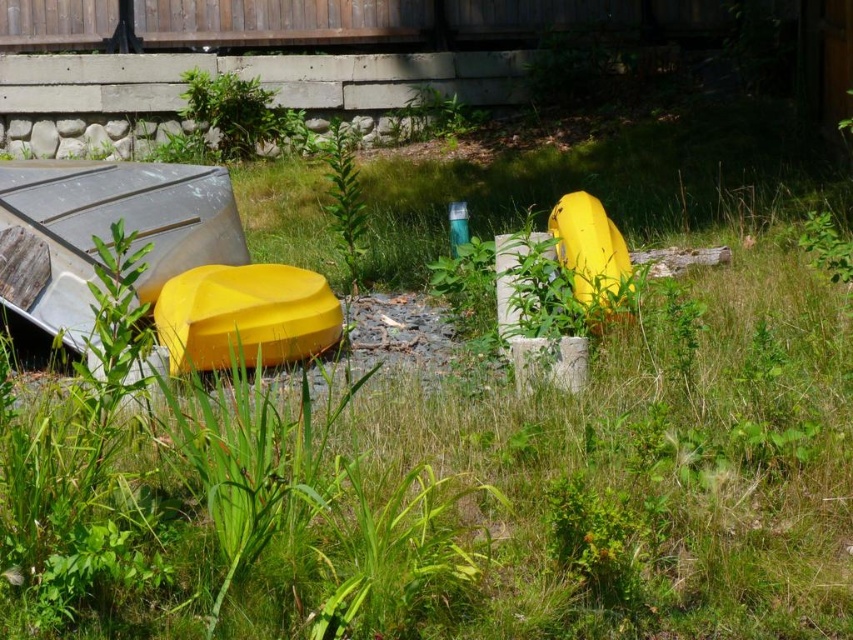
Consider the image. You are a painter who needs to paint both the matte yellow kayak at left and the yellow matte boat at center. You have a ladder that can reach up to 2 meters. Considering their heights, which one will require the ladder to paint?

The matte yellow kayak at left has a greater height compared to the yellow matte boat at center, so the matte yellow kayak at left will require the ladder to paint.

You are a delivery person needing to place a package between the matte yellow kayak at left and the yellow matte boat at center. The package requires 60 centimeters of space. Can you fit it there?

The distance between the matte yellow kayak at left and the yellow matte boat at center is 65.90 centimeters, which is more than enough to accommodate the 60 centimeter package.